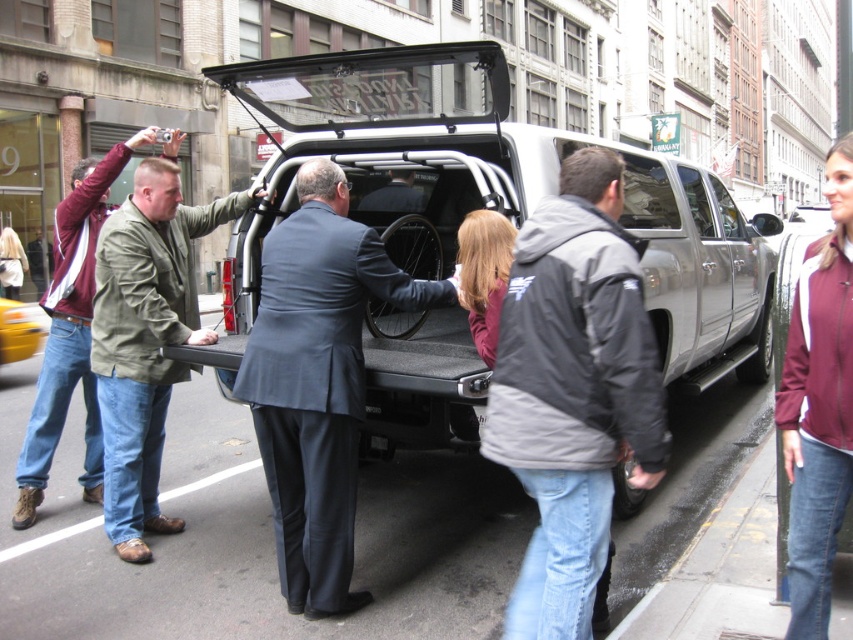
In the scene shown: You are standing in front of the pickup truck and want to place an object at point [280,269] and another object at point [119,368]. Which point is closer to you?

Point [280,269] is closer to the camera than point [119,368].